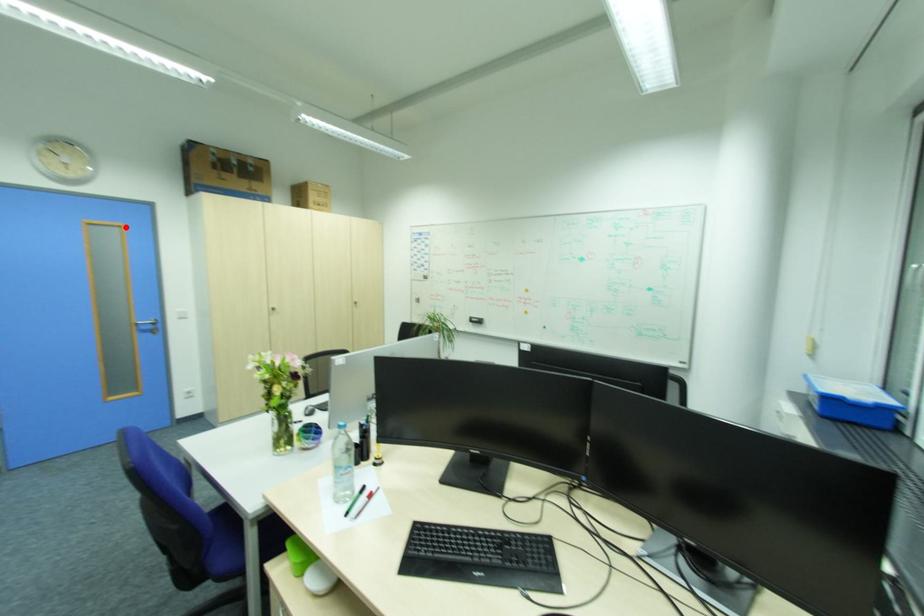
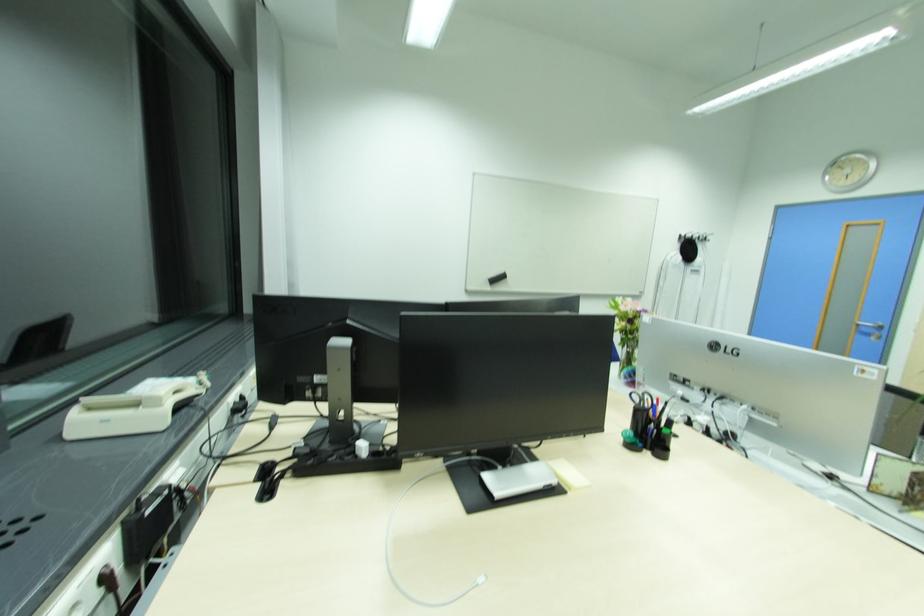
Find the pixel in the second image that matches the highlighted location in the first image.

(882, 224)